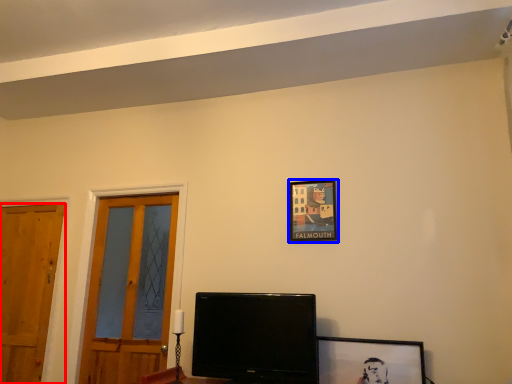
Question: Which of the following is the farthest to the observer, door (highlighted by a red box) or picture frame (highlighted by a blue box)?

Choices:
 (A) door
 (B) picture frame

Answer: (A)